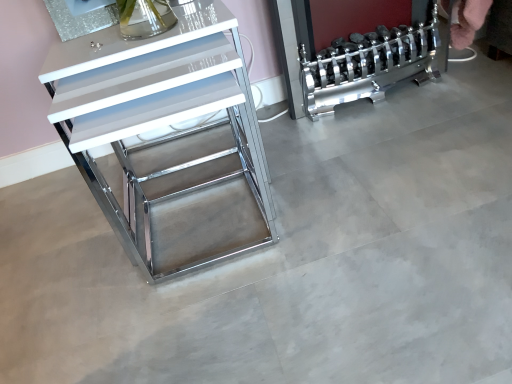
Question: From a real-world perspective, is white glossy drawer at left above or below chrome metallic dumbbell rack at right?

Choices:
 (A) below
 (B) above

Answer: (B)

Question: Do you think white glossy drawer at left is within chrome metallic dumbbell rack at right, or outside of it?

Choices:
 (A) inside
 (B) outside

Answer: (B)

Question: In the image, is white glossy drawer at left positioned in front of or behind chrome metallic dumbbell rack at right?

Choices:
 (A) front
 (B) behind

Answer: (A)

Question: Does point (432, 28) appear closer or farther from the camera than point (207, 200)?

Choices:
 (A) closer
 (B) farther

Answer: (B)

Question: In terms of width, does chrome metallic dumbbell rack at right look wider or thinner when compared to white glossy drawer at left?

Choices:
 (A) wide
 (B) thin

Answer: (B)

Question: In terms of size, does chrome metallic dumbbell rack at right appear bigger or smaller than white glossy drawer at left?

Choices:
 (A) small
 (B) big

Answer: (A)

Question: Would you say chrome metallic dumbbell rack at right is inside or outside white glossy drawer at left?

Choices:
 (A) outside
 (B) inside

Answer: (A)